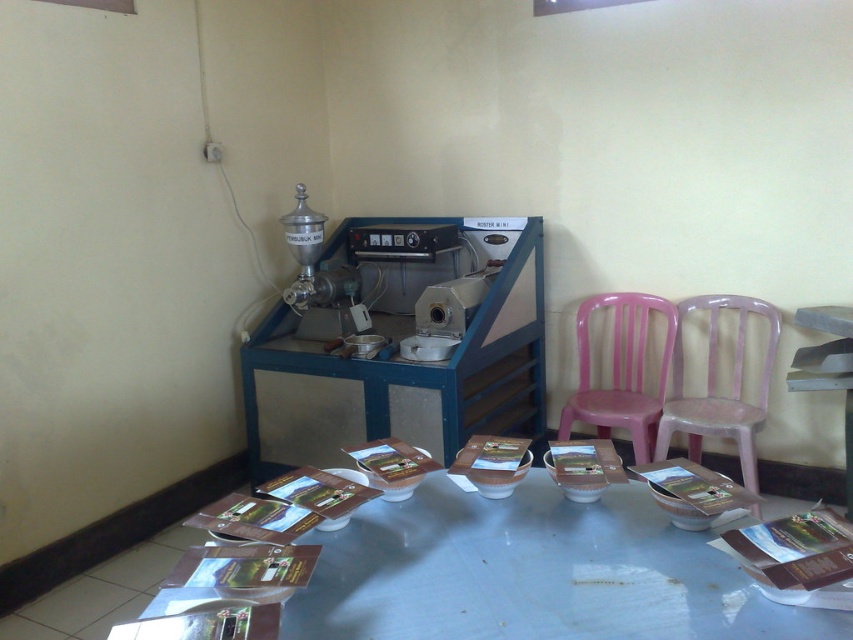
Question: Is pink plastic chair at center wider than pink plastic chair at right?

Choices:
 (A) yes
 (B) no

Answer: (B)

Question: Which object is the closest to the pink plastic chair at right?

Choices:
 (A) pink plastic chair at center
 (B) white glossy table at center

Answer: (A)

Question: Is white glossy table at center positioned behind pink plastic chair at center?

Choices:
 (A) yes
 (B) no

Answer: (B)

Question: Estimate the real-world distances between objects in this image. Which object is closer to the white glossy table at center?

Choices:
 (A) pink plastic chair at right
 (B) pink plastic chair at center

Answer: (A)

Question: Does white glossy table at center lie behind pink plastic chair at right?

Choices:
 (A) yes
 (B) no

Answer: (B)

Question: Which is nearer to the white glossy table at center?

Choices:
 (A) pink plastic chair at center
 (B) pink plastic chair at right

Answer: (B)